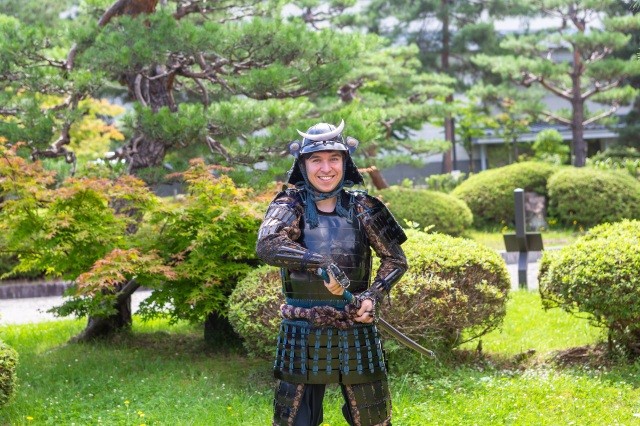
At what (x,y) coordinates should I click in order to perform the action: click on wood post. Please return your answer as a coordinate pair (x, y). This screenshot has width=640, height=426. Looking at the image, I should click on (527, 242).